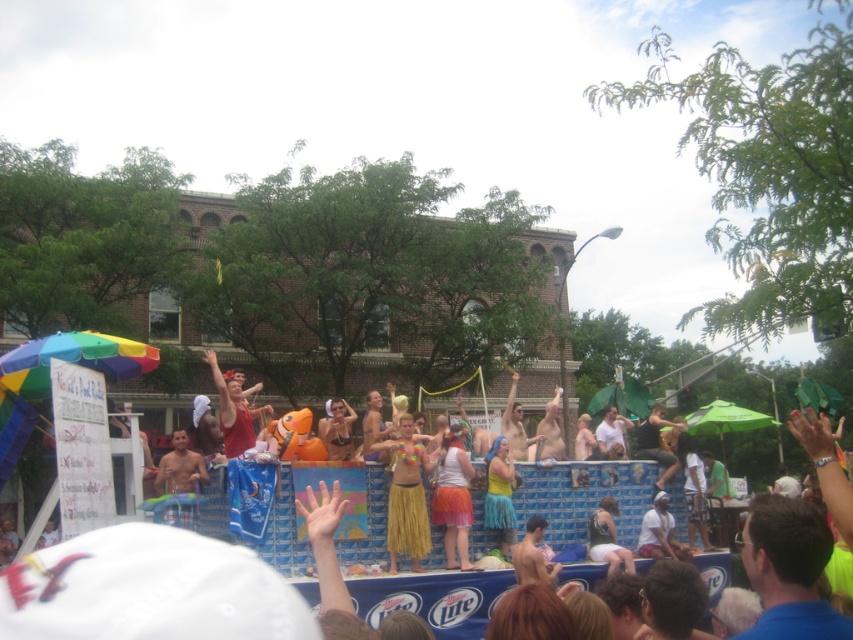
Question: Based on their relative distances, which object is nearer to the red fabric shirt at center?

Choices:
 (A) yellow grass skirt at center
 (B) orange fabric skirt at center

Answer: (A)

Question: Which of the following is the farthest from the observer?

Choices:
 (A) orange fabric skirt at center
 (B) red fabric shirt at center

Answer: (A)

Question: Does yellow grass skirt at center have a lesser width compared to orange fabric skirt at center?

Choices:
 (A) no
 (B) yes

Answer: (B)

Question: Which of these objects is positioned farthest from the yellow grass skirt at center?

Choices:
 (A) red fabric shirt at center
 (B) orange fabric skirt at center

Answer: (A)

Question: Does yellow grass skirt at center appear over red fabric shirt at center?

Choices:
 (A) yes
 (B) no

Answer: (B)

Question: Is yellow grass skirt at center wider than red fabric shirt at center?

Choices:
 (A) yes
 (B) no

Answer: (B)